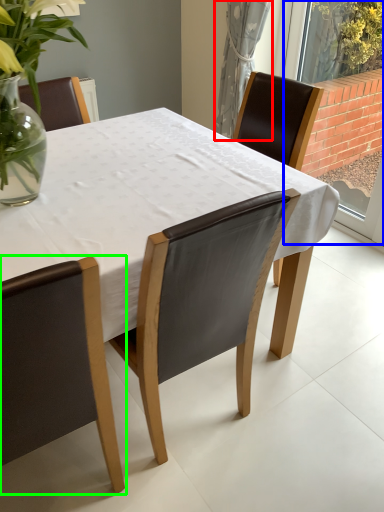
Question: Based on their relative distances, which object is farther from curtain (highlighted by a red box)? Choose from window (highlighted by a blue box) and chair (highlighted by a green box).

Choices:
 (A) window
 (B) chair

Answer: (B)